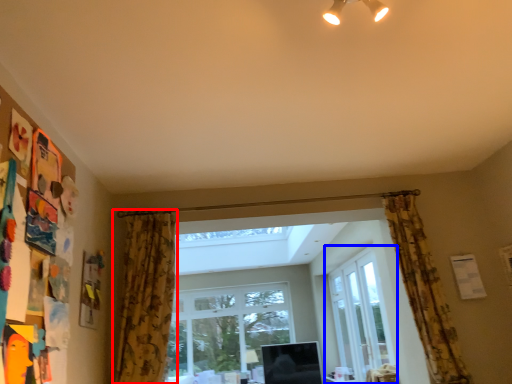
Question: Which object appears farthest to the camera in this image, curtain (highlighted by a red box) or window (highlighted by a blue box)?

Choices:
 (A) curtain
 (B) window

Answer: (B)